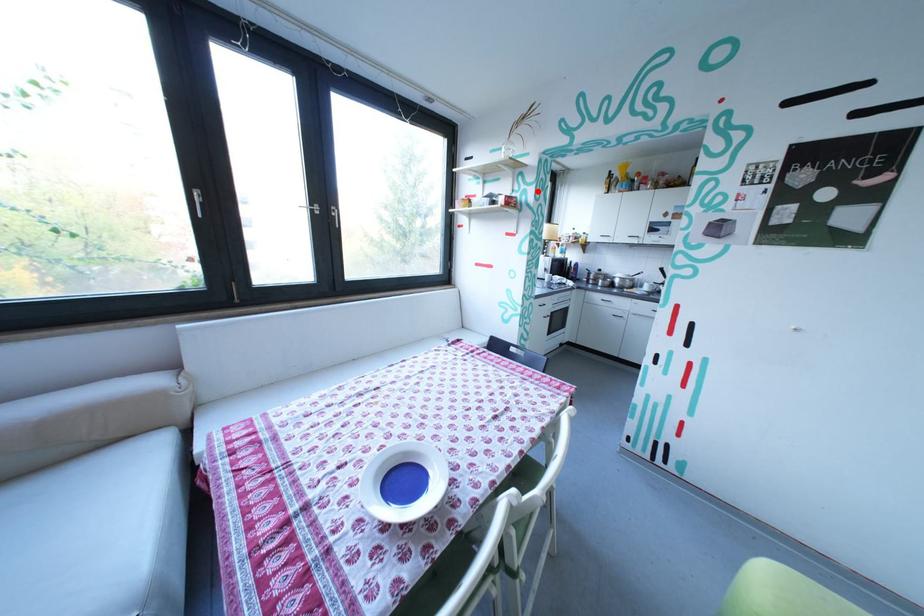
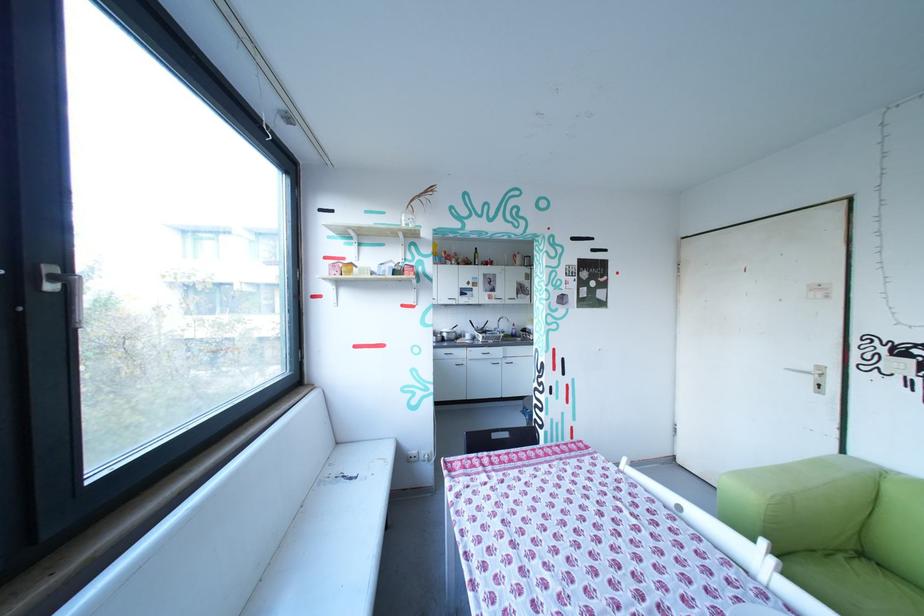
The point at the highlighted location is marked in the first image. Where is the corresponding point in the second image?

(433, 262)